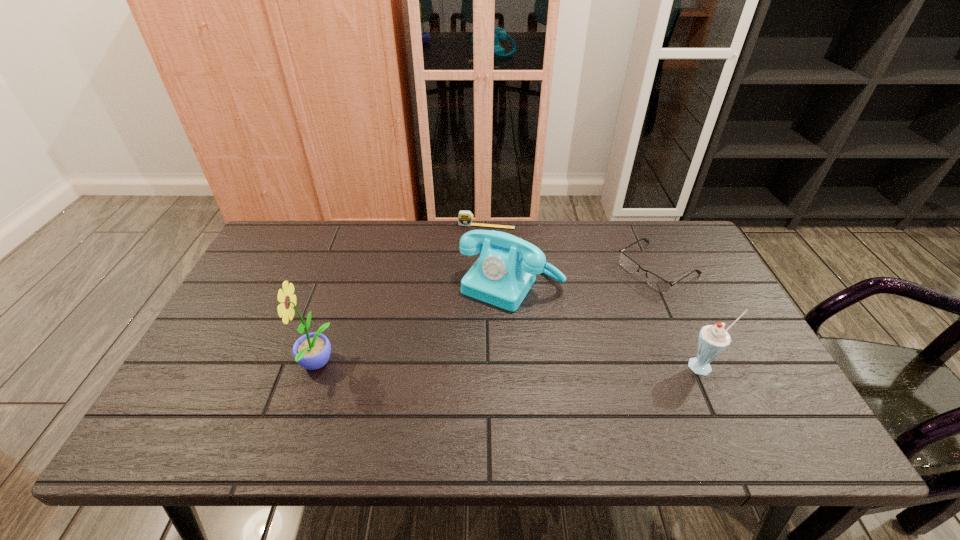
What are the coordinates of `free space between the spectacles and the milkshake` in the screenshot? It's located at (681, 318).

Image resolution: width=960 pixels, height=540 pixels. I want to click on blank region between the spectacles and the telephone, so click(585, 276).

Identify which object is the nearest to the milkshake. Please provide its 2D coordinates. Your answer should be formatted as a tuple, i.e. [(x, y)], where the tuple contains the x and y coordinates of a point satisfying the conditions above.

[(656, 282)]

Point out which object is positioned as the second nearest to the milkshake. Please provide its 2D coordinates. Your answer should be formatted as a tuple, i.e. [(x, y)], where the tuple contains the x and y coordinates of a point satisfying the conditions above.

[(507, 267)]